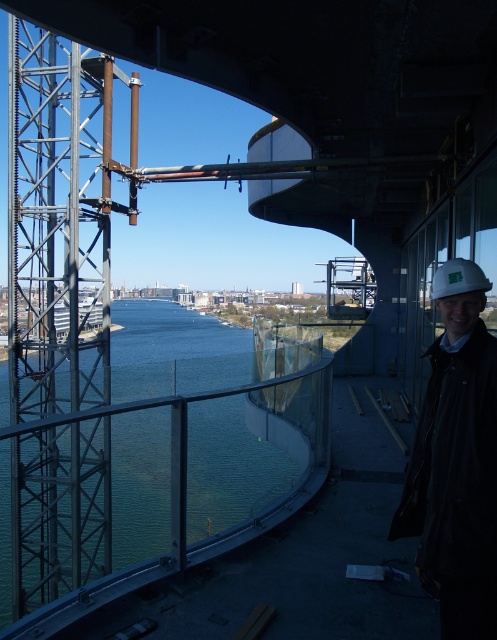
Can you confirm if clear glass water at center is taller than white hard hat at right?

Yes, clear glass water at center is taller than white hard hat at right.

Can you confirm if clear glass water at center is wider than white hard hat at right?

Yes.

Between point (286, 349) and point (492, 419), which one is positioned behind?

The point (286, 349) is more distant.

This screenshot has height=640, width=497. Identify the location of clear glass water at center. (230, 467).